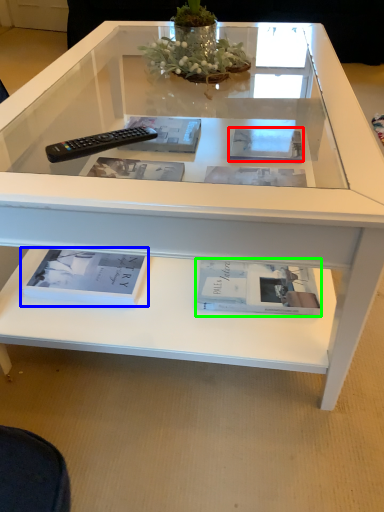
Question: Which object is positioned farthest from magazine (highlighted by a red box)? Select from book (highlighted by a blue box) and book (highlighted by a green box).

Choices:
 (A) book
 (B) book

Answer: (A)